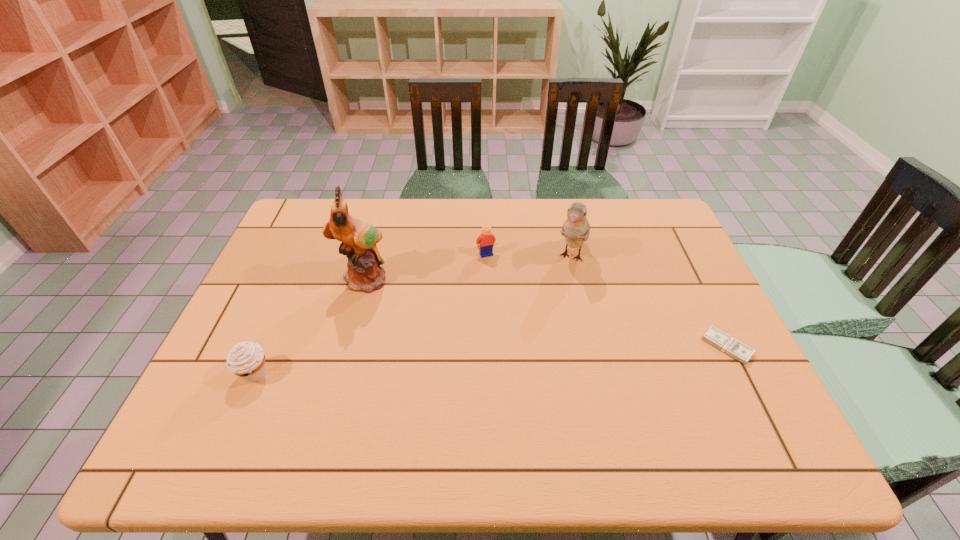
Locate an element on the screen. object at the near edge is located at coordinates (246, 359).

Identify the location of object that is at the left edge. Image resolution: width=960 pixels, height=540 pixels. (246, 359).

The width and height of the screenshot is (960, 540). Identify the location of object positioned at the right edge. (739, 351).

Where is `object that is positioned at the near left corner`? The image size is (960, 540). object that is positioned at the near left corner is located at coordinates (246, 359).

The image size is (960, 540). In order to click on vacant area at the far edge of the desktop in this screenshot , I will do `click(469, 200)`.

Locate an element on the screen. This screenshot has width=960, height=540. vacant space at the near edge of the desktop is located at coordinates (464, 394).

This screenshot has height=540, width=960. Find the location of `free space at the left edge of the desktop`. free space at the left edge of the desktop is located at coordinates (289, 305).

You are a GUI agent. You are given a task and a screenshot of the screen. Output one action in this format:
    pyautogui.click(x=<x>, y=<y>)
    Task: Click on the free space at the right edge
    The width and height of the screenshot is (960, 540).
    Given the screenshot: What is the action you would take?
    pyautogui.click(x=651, y=242)

This screenshot has height=540, width=960. Find the location of `free location at the far left corner of the desktop`. free location at the far left corner of the desktop is located at coordinates (301, 216).

I want to click on vacant space at the near left corner of the desktop, so click(261, 390).